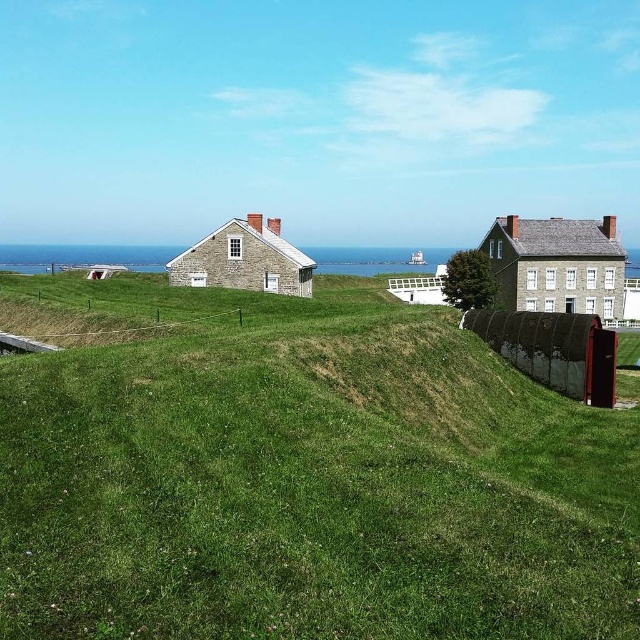
Question: From the image, what is the correct spatial relationship of gray stone house at right in relation to stone house at center?

Choices:
 (A) left
 (B) right

Answer: (B)

Question: Which point appears closest to the camera in this image?

Choices:
 (A) (544, 305)
 (B) (131, 614)
 (C) (260, 216)

Answer: (B)

Question: Where is gray stone house at right located in relation to stone house at center in the image?

Choices:
 (A) below
 (B) above

Answer: (B)

Question: Which of the following is the closest to the observer?

Choices:
 (A) (582, 291)
 (B) (381, 324)
 (C) (208, 257)

Answer: (B)

Question: Is green grassy hill at center to the right of stone house at center from the viewer's perspective?

Choices:
 (A) no
 (B) yes

Answer: (B)

Question: Based on their relative distances, which object is nearer to the gray stone house at right?

Choices:
 (A) green grassy hill at center
 (B) stone house at center

Answer: (B)